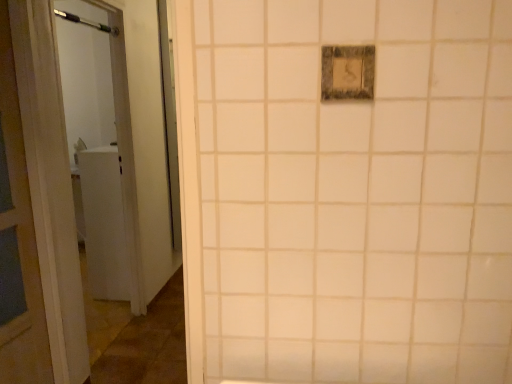
Question: Is brushed metal shower at upper left far from matte gray switch at upper center?

Choices:
 (A) no
 (B) yes

Answer: (B)

Question: Is brushed metal shower at upper left aimed at matte gray switch at upper center?

Choices:
 (A) yes
 (B) no

Answer: (B)

Question: Is brushed metal shower at upper left positioned behind matte gray switch at upper center?

Choices:
 (A) yes
 (B) no

Answer: (A)

Question: Can you confirm if brushed metal shower at upper left is positioned to the left of matte gray switch at upper center?

Choices:
 (A) yes
 (B) no

Answer: (A)

Question: From a real-world perspective, is brushed metal shower at upper left located higher than matte gray switch at upper center?

Choices:
 (A) no
 (B) yes

Answer: (B)

Question: Does brushed metal shower at upper left have a larger size compared to matte gray switch at upper center?

Choices:
 (A) no
 (B) yes

Answer: (B)

Question: Is the position of matte gray switch at upper center less distant than that of brushed metal shower at upper left?

Choices:
 (A) yes
 (B) no

Answer: (A)

Question: Is matte gray switch at upper center to the right of brushed metal shower at upper left from the viewer's perspective?

Choices:
 (A) yes
 (B) no

Answer: (A)

Question: Considering the relative sizes of matte gray switch at upper center and brushed metal shower at upper left in the image provided, is matte gray switch at upper center smaller than brushed metal shower at upper left?

Choices:
 (A) yes
 (B) no

Answer: (A)

Question: Would you say matte gray switch at upper center is outside brushed metal shower at upper left?

Choices:
 (A) no
 (B) yes

Answer: (B)

Question: Considering the relative sizes of matte gray switch at upper center and brushed metal shower at upper left in the image provided, is matte gray switch at upper center thinner than brushed metal shower at upper left?

Choices:
 (A) yes
 (B) no

Answer: (A)

Question: Is matte gray switch at upper center bigger than brushed metal shower at upper left?

Choices:
 (A) yes
 (B) no

Answer: (B)

Question: Does point (370, 94) appear closer or farther from the camera than point (65, 18)?

Choices:
 (A) closer
 (B) farther

Answer: (A)